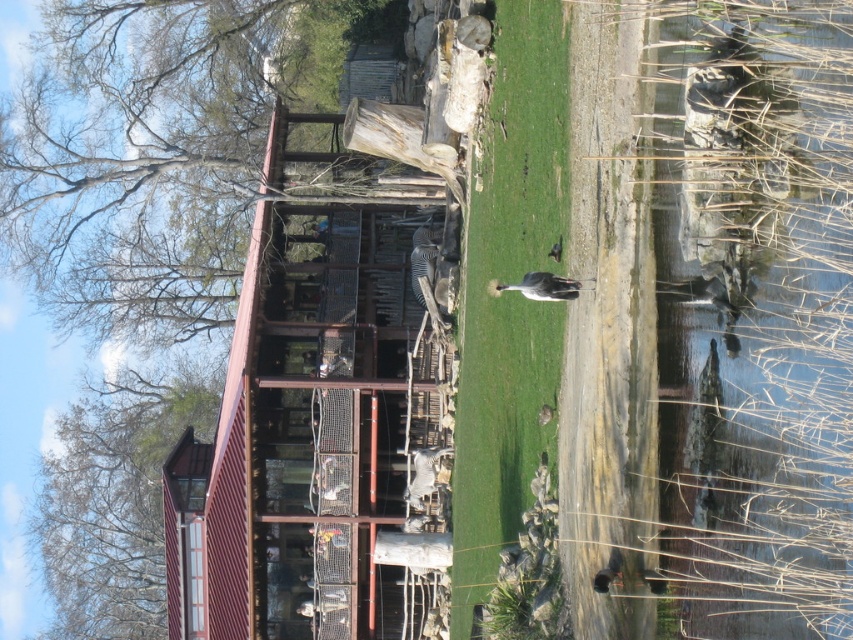
Question: Estimate the real-world distances between objects in this image. Which object is closer to the white feathered bird at center?

Choices:
 (A) brown feathered bird at center
 (B) green grass at center
 (C) bare wood tree at upper left

Answer: (B)

Question: Which of the following is the closest to the observer?

Choices:
 (A) (525, 282)
 (B) (76, 461)
 (C) (328, 497)

Answer: (A)

Question: Can you confirm if white feathered bird at center is smaller than brown feathered bird at center?

Choices:
 (A) no
 (B) yes

Answer: (B)

Question: Among these points, which one is farthest from the camera?

Choices:
 (A) (561, 243)
 (B) (91, 490)

Answer: (B)

Question: Can you confirm if clear water at right is smaller than white feathered bird at center?

Choices:
 (A) yes
 (B) no

Answer: (B)

Question: Does bare wood tree at upper left appear over white feathered bird at center?

Choices:
 (A) yes
 (B) no

Answer: (B)